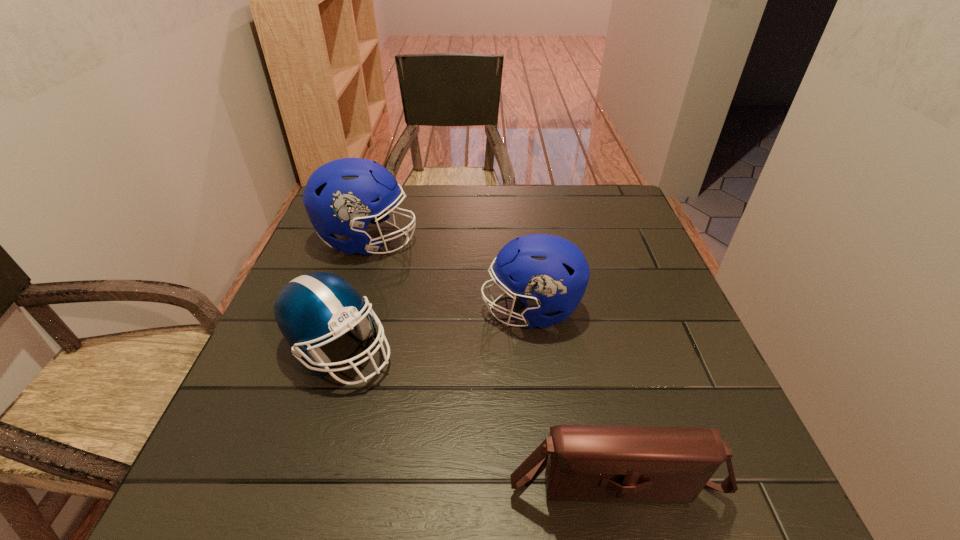
The height and width of the screenshot is (540, 960). Identify the location of object located in the right edge section of the desktop. (641, 464).

The image size is (960, 540). I want to click on object located in the far left corner section of the desktop, so click(341, 197).

Find the location of a particular element. Image resolution: width=960 pixels, height=540 pixels. object that is at the near right corner is located at coordinates (641, 464).

The height and width of the screenshot is (540, 960). I want to click on free space at the far edge of the desktop, so click(425, 188).

Locate an element on the screen. Image resolution: width=960 pixels, height=540 pixels. vacant space at the left edge of the desktop is located at coordinates (321, 242).

Where is `vacant point at the right edge`? This screenshot has width=960, height=540. vacant point at the right edge is located at coordinates point(613,258).

You are a GUI agent. You are given a task and a screenshot of the screen. Output one action in this format:
    pyautogui.click(x=<x>, y=<y>)
    Task: Click on the vacant space at the near left corner of the desktop
    The image size is (960, 540).
    Given the screenshot: What is the action you would take?
    pyautogui.click(x=269, y=480)

Where is `blank region between the nearest object and the tallest football helmet`? The width and height of the screenshot is (960, 540). blank region between the nearest object and the tallest football helmet is located at coordinates (491, 358).

Locate an element on the screen. The width and height of the screenshot is (960, 540). vacant area that lies between the nearest object and the rightmost football helmet is located at coordinates (572, 393).

Locate an element on the screen. Image resolution: width=960 pixels, height=540 pixels. free point between the shoulder bag and the rightmost football helmet is located at coordinates (572, 393).